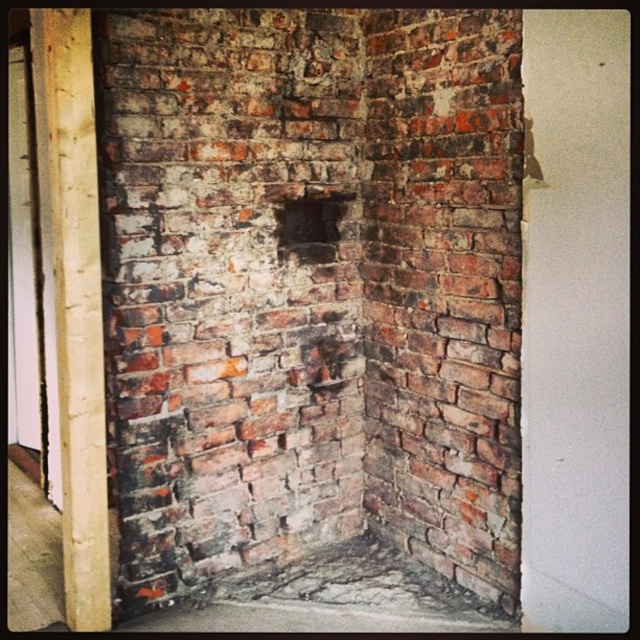
Question: Which object appears closest to the camera in this image?

Choices:
 (A) weathered brick at center
 (B) dark brick hole at center

Answer: (A)

Question: Can you confirm if weathered brick at center is positioned below dark brick hole at center?

Choices:
 (A) yes
 (B) no

Answer: (A)

Question: Can you confirm if weathered brick at center is positioned below dark brick hole at center?

Choices:
 (A) yes
 (B) no

Answer: (A)

Question: Which point is closer to the camera?

Choices:
 (A) dark brick hole at center
 (B) weathered brick at center

Answer: (B)

Question: From the image, what is the correct spatial relationship of weathered brick at center in relation to dark brick hole at center?

Choices:
 (A) below
 (B) above

Answer: (A)